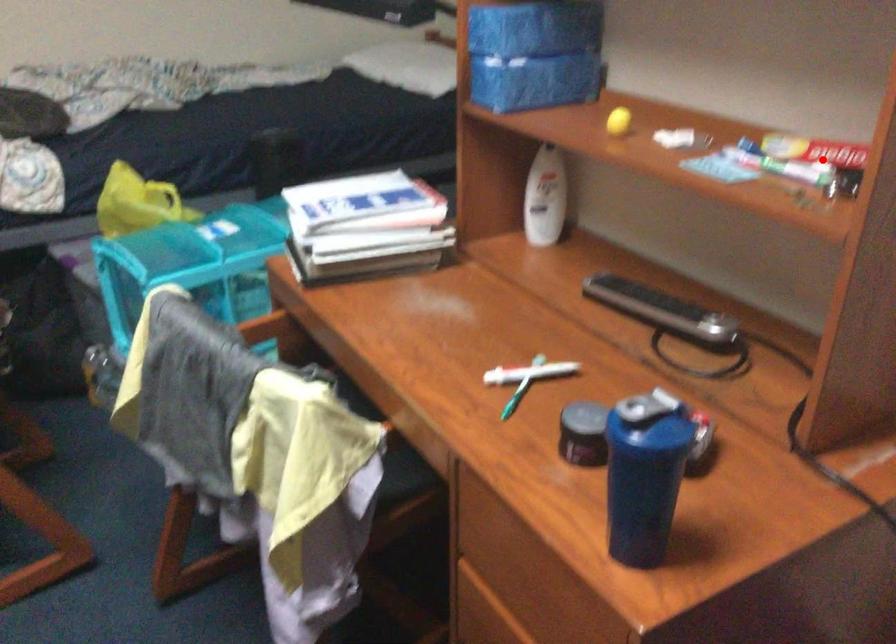
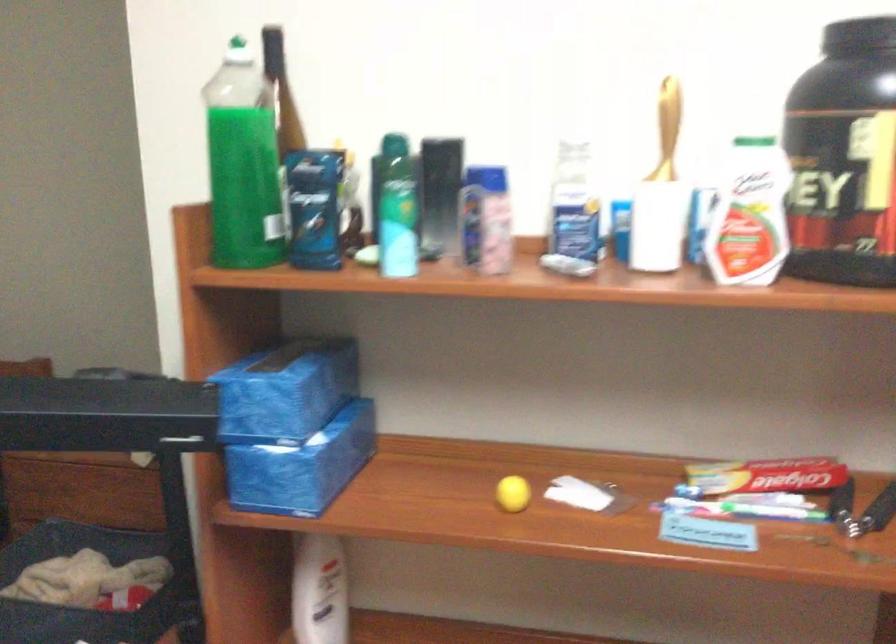
Where in the second image is the point corresponding to the highlighted location from the first image?

(764, 483)